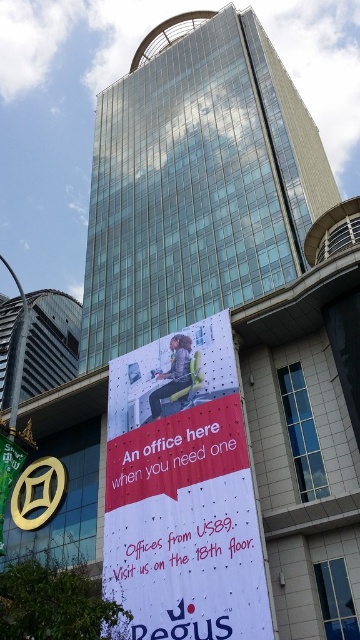
Between glassy steel building at center and white paper banner at center, which one has more height?

glassy steel building at center is taller.

Is glassy steel building at center positioned in front of white paper banner at center?

No, it is behind white paper banner at center.

Is point (295, 176) in front of point (172, 404)?

No, it is behind (172, 404).

In order to click on glassy steel building at center in this screenshot , I will do `click(195, 182)`.

Which is in front, point (203, 81) or point (14, 368)?

Point (203, 81) is in front.

Is point (212, 278) less distant than point (24, 328)?

Yes, point (212, 278) is in front of point (24, 328).

Describe the element at coordinates (195, 182) in the screenshot. This screenshot has height=640, width=360. I see `glassy steel building at center` at that location.

Locate an element on the screen. glassy steel building at center is located at coordinates (195, 182).

Is glassy skyscraper at upper left above smooth metallic pole at left?

No, glassy skyscraper at upper left is not above smooth metallic pole at left.

Who is higher up, glassy skyscraper at upper left or smooth metallic pole at left?

smooth metallic pole at left is higher up.

What do you see at coordinates (51, 340) in the screenshot? I see `glassy skyscraper at upper left` at bounding box center [51, 340].

You are a GUI agent. You are given a task and a screenshot of the screen. Output one action in this format:
    pyautogui.click(x=<x>, y=<y>)
    Task: Click on the glassy skyscraper at upper left
    
    Given the screenshot: What is the action you would take?
    pyautogui.click(x=51, y=340)